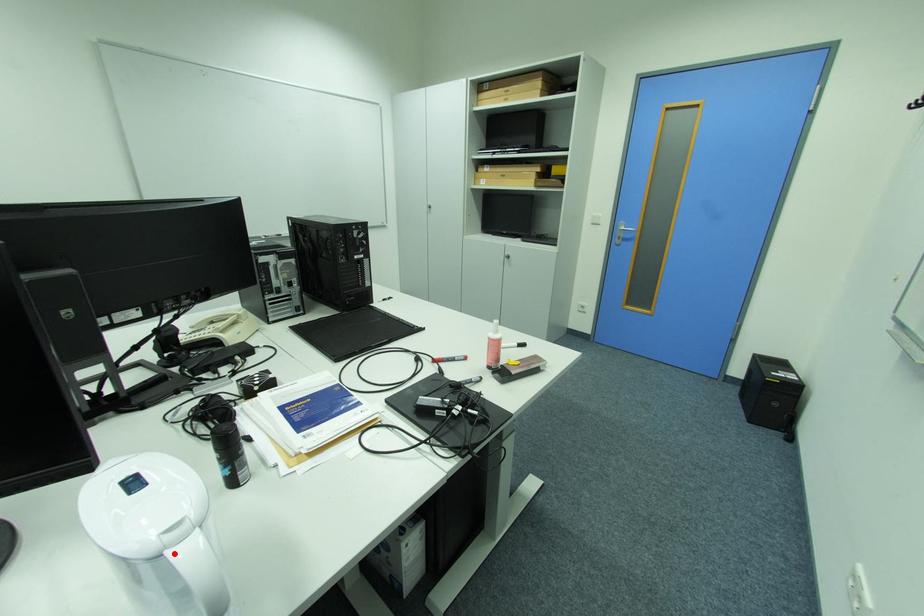
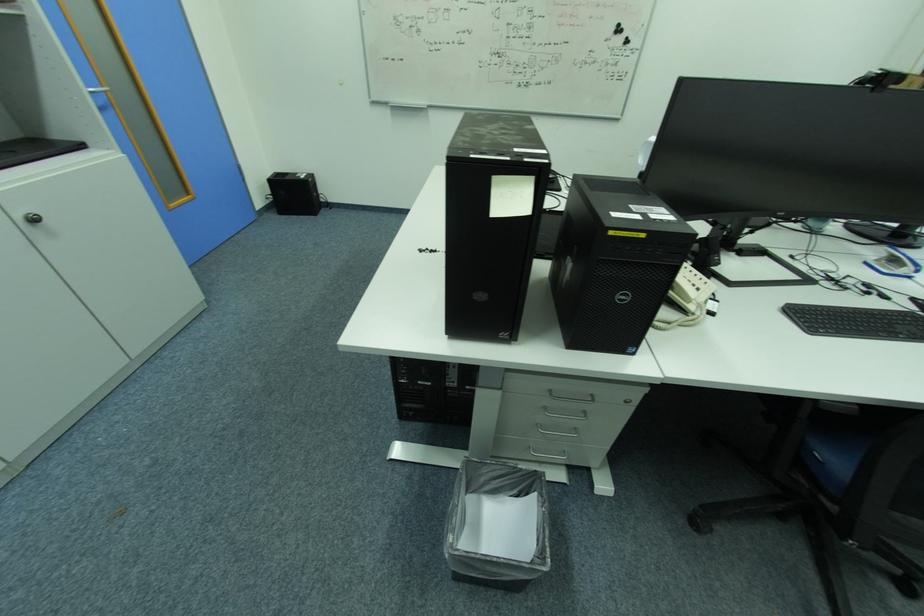
Question: I am providing you with two images of the same scene from different viewpoints. A red point is marked on the first image. Can you still see the location of the red point in image 2?

Choices:
 (A) Yes
 (B) No

Answer: (B)